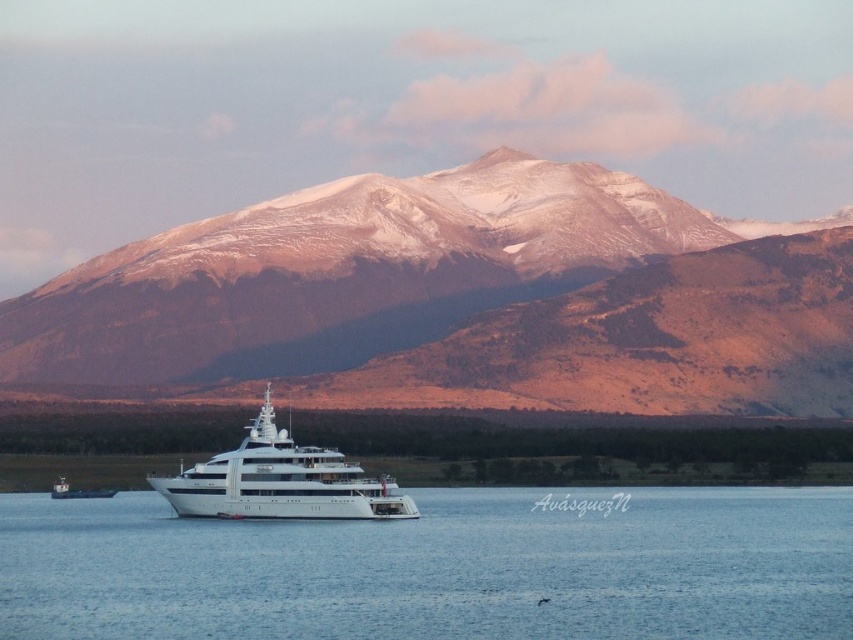
Question: Observing the image, what is the correct spatial positioning of clear blue water at center in reference to white glossy yacht at center?

Choices:
 (A) left
 (B) right

Answer: (B)

Question: Can you confirm if clear blue water at center is positioned to the left of white glossy yacht at center?

Choices:
 (A) yes
 (B) no

Answer: (B)

Question: Considering the real-world distances, which object is closest to the clear blue water at center?

Choices:
 (A) snowy mountain range at center
 (B) white glossy cruise ship at center
 (C) white glossy yacht at center

Answer: (B)

Question: Is the position of snowy mountain range at center less distant than that of white glossy yacht at center?

Choices:
 (A) yes
 (B) no

Answer: (A)

Question: Which object is farther from the camera taking this photo?

Choices:
 (A) white glossy cruise ship at center
 (B) clear blue water at center
 (C) white glossy yacht at center
 (D) snowy mountain range at center

Answer: (C)

Question: Which object appears farthest from the camera in this image?

Choices:
 (A) white glossy yacht at center
 (B) clear blue water at center

Answer: (A)